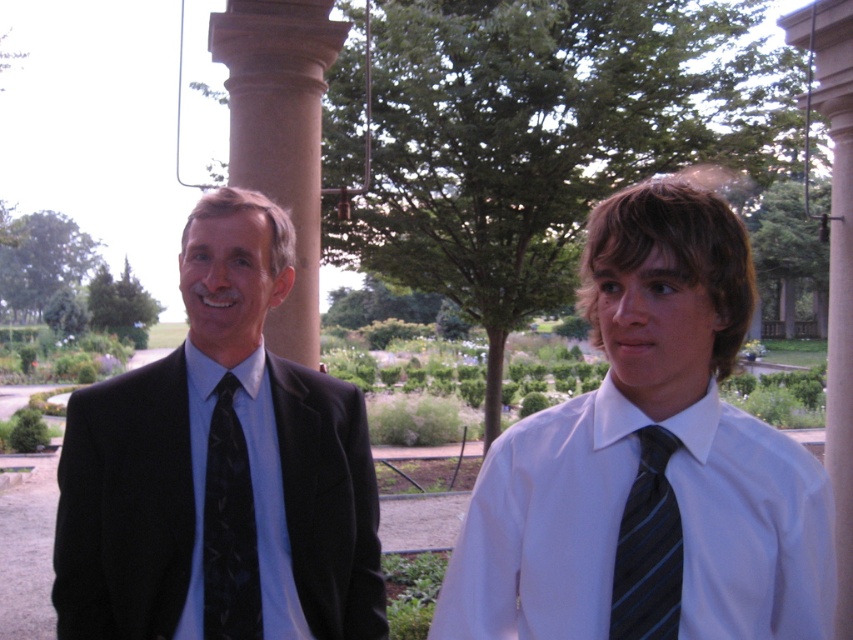
You are a photographer setting up for a group photo. You notice the black matte suit at left and the matte blue shirt at left in the frame. Which clothing item will appear larger in the photo?

The black matte suit at left is bigger than the matte blue shirt at left, so it will appear larger in the photo.

You are a photographer trying to decide which of the two individuals in the image is wearing a suit that is wider. The options are the matte black suit at left and the black matte suit at left. Which one should you choose?

The black matte suit at left is wider than the matte black suit at left, so you should choose the black matte suit at left.

You are a photographer standing at the center of the scene. You need to position a spotlight at point (639, 451) to highlight the matte black suit at left. Where should you direct the spotlight?

The matte black suit at left is located at point (639, 451), so you should direct the spotlight to that coordinate to highlight it.